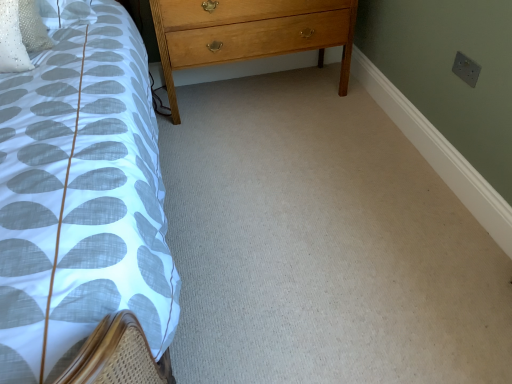
Describe the element at coordinates (248, 32) in the screenshot. This screenshot has height=384, width=512. I see `light brown wood chest of drawers at center` at that location.

I want to click on light brown wood chest of drawers at center, so click(x=248, y=32).

Locate an element on the screen. light brown wood chest of drawers at center is located at coordinates (248, 32).